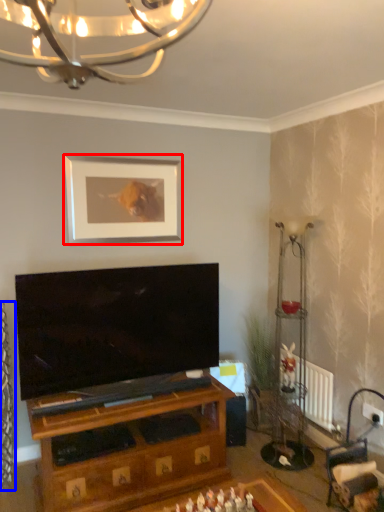
Question: Among these objects, which one is farthest to the camera, picture frame (highlighted by a red box) or curtain (highlighted by a blue box)?

Choices:
 (A) picture frame
 (B) curtain

Answer: (A)